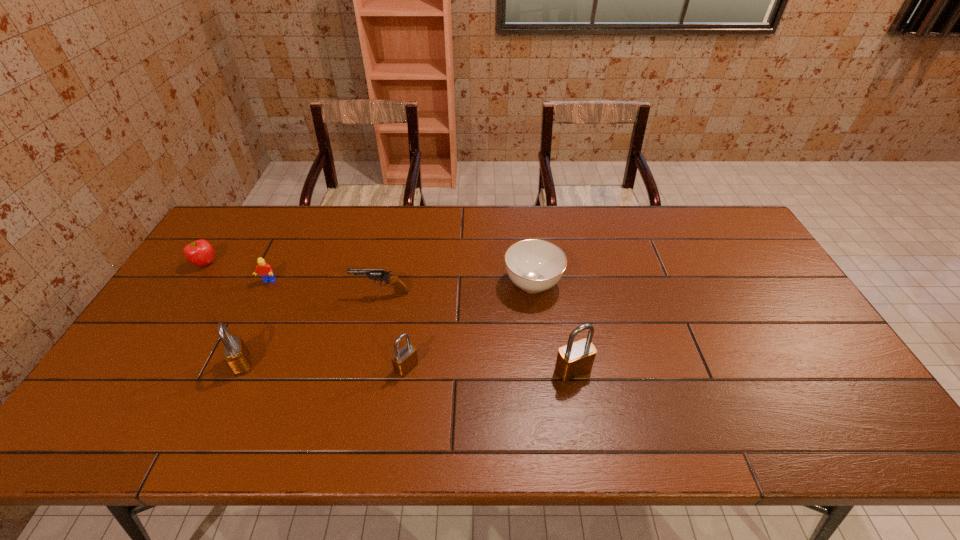
Observe the arrangement of all padlocks in the image. To keep them evenly spaced, where would you place another padlock on the right? Please locate a free space. Please provide its 2D coordinates. Your answer should be formatted as a tuple, i.e. [(x, y)], where the tuple contains the x and y coordinates of a point satisfying the conditions above.

[(741, 373)]